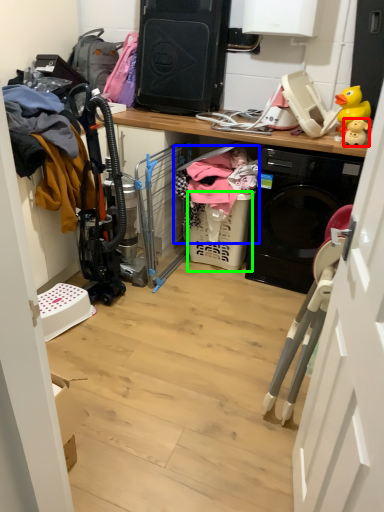
Question: Which is nearer to the toy (highlighted by a red box)? clothing (highlighted by a blue box) or basket (highlighted by a green box).

Choices:
 (A) clothing
 (B) basket

Answer: (A)